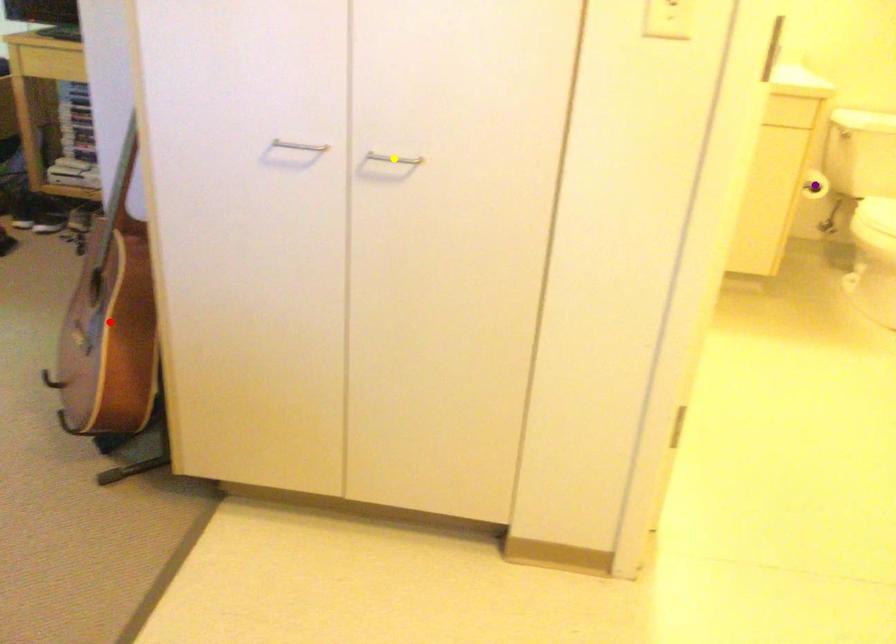
Order these from nearest to farthest:
A) red point
B) purple point
C) yellow point

yellow point, red point, purple point